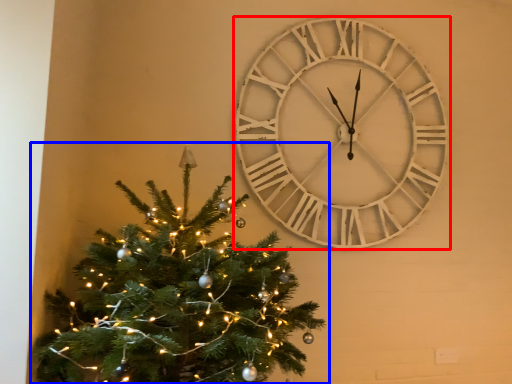
Question: Which object is closer to the camera taking this photo, wall clock (highlighted by a red box) or christmas tree (highlighted by a blue box)?

Choices:
 (A) wall clock
 (B) christmas tree

Answer: (B)